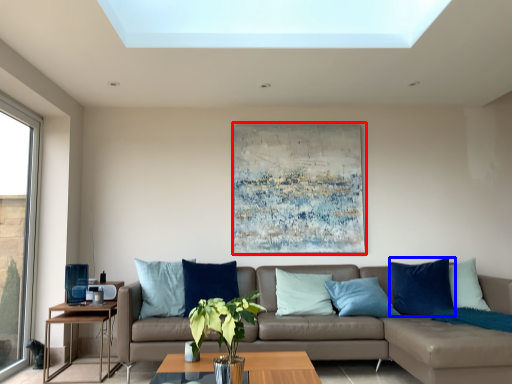
Question: Among these objects, which one is farthest to the camera, picture frame (highlighted by a red box) or pillow (highlighted by a blue box)?

Choices:
 (A) picture frame
 (B) pillow

Answer: (A)